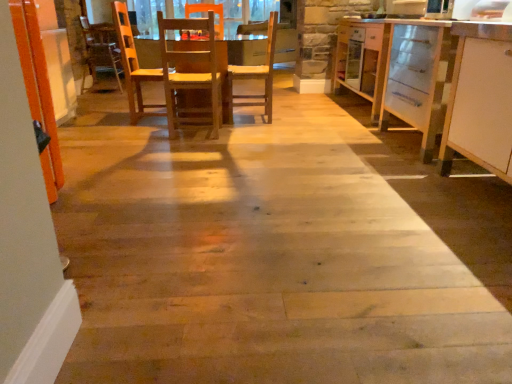
Measure the distance between white matte cabinet at right and camera.

The distance of white matte cabinet at right from camera is 6.53 feet.

What is the approximate height of white matte cabinet at right?

white matte cabinet at right is 3.32 feet tall.

Find the location of a particular element. wooden table at center is located at coordinates (246, 48).

The height and width of the screenshot is (384, 512). In order to click on wooden chair at center, which is counted as the 1th chair, starting from the right in this screenshot , I will do `click(255, 76)`.

Is white matte cabinet at right oriented away from wooden table at center?

white matte cabinet at right does not have its back to wooden table at center.

Consider the image. Between white matte cabinet at right and wooden table at center, which one has smaller width?

With smaller width is white matte cabinet at right.

Is point (471, 82) in front of point (152, 64)?

Yes, point (471, 82) is in front of point (152, 64).

Based on the photo, is white matte cabinet at right bigger than wooden table at center?

Incorrect, white matte cabinet at right is not larger than wooden table at center.

What's the angular difference between white matte cabinet at right and wooden chair at center, the second chair from the right,'s facing directions?

There is a 90.3-degree angle between the facing directions of white matte cabinet at right and wooden chair at center, the second chair from the right.

Is white matte cabinet at right turned away from wooden chair at center, marked as the 1th chair in a left-to-right arrangement?

No.

Based on the photo, considering the relative sizes of white matte cabinet at right and wooden chair at center, the second chair from the right, in the image provided, is white matte cabinet at right shorter than wooden chair at center, the second chair from the right,?

Incorrect, the height of white matte cabinet at right does not fall short of that of wooden chair at center, the second chair from the right.

Measure the distance from white matte cabinet at right to wooden chair at center, the second chair from the right.

The distance of white matte cabinet at right from wooden chair at center, the second chair from the right, is 1.91 meters.

Is wooden table at center turned away from wooden chair at center, the second chair from the right?

Yes, wooden table at center is positioned with its back facing wooden chair at center, the second chair from the right.

At what (x,y) coordinates should I click in order to perform the action: click on table behind the wooden chair at center, marked as the 1th chair in a left-to-right arrangement. Please return your answer as a coordinate pair (x, y). Image resolution: width=512 pixels, height=384 pixels. Looking at the image, I should click on coord(246,48).

From a real-world perspective, which is physically below, wooden table at center or wooden chair at center, marked as the 1th chair in a left-to-right arrangement?

In real-world perspective, wooden table at center is lower.

From the image's perspective, is wooden table at center below wooden chair at center, marked as the 1th chair in a left-to-right arrangement?

No, from the image's perspective, wooden table at center is not beneath wooden chair at center, marked as the 1th chair in a left-to-right arrangement.

Is white matte cabinet at right thinner than wooden chair at center, which is counted as the 1th chair, starting from the right?

In fact, white matte cabinet at right might be wider than wooden chair at center, which is counted as the 1th chair, starting from the right.

Is white matte cabinet at right not close to wooden chair at center, which is counted as the 1th chair, starting from the right?

Absolutely, white matte cabinet at right is distant from wooden chair at center, which is counted as the 1th chair, starting from the right.

Is white matte cabinet at right turned away from wooden chair at center, which is counted as the 1th chair, starting from the right?

No, wooden chair at center, which is counted as the 1th chair, starting from the right, is not at the back of white matte cabinet at right.

Is wooden chair at center, which is counted as the 1th chair, starting from the right, completely or partially inside white matte cabinet at right?

No, wooden chair at center, which is counted as the 1th chair, starting from the right, is not a part of white matte cabinet at right.

Is wooden table at center further to camera compared to white matte cabinet at right?

That is True.

Considering the positions of objects wooden table at center and white matte cabinet at right in the image provided, who is more to the right, wooden table at center or white matte cabinet at right?

Positioned to the right is white matte cabinet at right.

From the picture: Could you tell me if wooden table at center is turned towards white matte cabinet at right?

No, wooden table at center is not oriented towards white matte cabinet at right.

From the picture: Do you think wooden table at center is within white matte cabinet at right, or outside of it?

wooden table at center is not inside white matte cabinet at right, it's outside.

In the scene shown: Who is bigger, wooden chair at center, the 2th chair in the left-to-right sequence, or white matte cabinet at right?

white matte cabinet at right is bigger.

Which object is positioned more to the left, wooden chair at center, the 2th chair in the left-to-right sequence, or white matte cabinet at right?

wooden chair at center, the 2th chair in the left-to-right sequence, is more to the left.

Is wooden chair at center, the 2th chair in the left-to-right sequence, wider than white matte cabinet at right?

No.

Between wooden chair at center, which is counted as the 1th chair, starting from the right, and white matte cabinet at right, which one is positioned behind?

wooden chair at center, which is counted as the 1th chair, starting from the right, is further from the camera.

Is wooden chair at center, marked as the 1th chair in a left-to-right arrangement, outside of white matte cabinet at right?

Yes, wooden chair at center, marked as the 1th chair in a left-to-right arrangement, is located beyond the bounds of white matte cabinet at right.

In the image, is wooden chair at center, the second chair from the right, on the left side or the right side of white matte cabinet at right?

In the image, wooden chair at center, the second chair from the right, appears on the left side of white matte cabinet at right.

From the image's perspective, which one is positioned lower, wooden chair at center, marked as the 1th chair in a left-to-right arrangement, or white matte cabinet at right?

From the image's view, white matte cabinet at right is below.

What are the coordinates of `cabinetry above the wooden table at center (from a real-world perspective)` in the screenshot? It's located at (480, 100).

You are a GUI agent. You are given a task and a screenshot of the screen. Output one action in this format:
    pyautogui.click(x=<x>, y=<y>)
    Task: Click on the 2nd chair to the left of the white matte cabinet at right, starting your count from the anchor
    The height and width of the screenshot is (384, 512).
    Given the screenshot: What is the action you would take?
    pyautogui.click(x=191, y=74)

When comparing their distances from wooden table at center, does white matte cabinet at right or wooden chair at center, the second chair from the right, seem further?

white matte cabinet at right lies further to wooden table at center than the other object.

Considering their positions, is wooden chair at center, marked as the 1th chair in a left-to-right arrangement, positioned further to white matte cabinet at right than wooden chair at center, the 2th chair in the left-to-right sequence?

wooden chair at center, marked as the 1th chair in a left-to-right arrangement, is positioned further to the anchor white matte cabinet at right.

Based on their spatial positions, is wooden chair at center, the second chair from the right, or white matte cabinet at right closer to wooden chair at center, the 2th chair in the left-to-right sequence?

The object closer to wooden chair at center, the 2th chair in the left-to-right sequence, is wooden chair at center, the second chair from the right.

From the image, which object appears to be farther from wooden chair at center, the 2th chair in the left-to-right sequence, wooden table at center or white matte cabinet at right?

A: Based on the image, white matte cabinet at right appears to be further to wooden chair at center, the 2th chair in the left-to-right sequence.

Estimate the real-world distances between objects in this image. Which object is closer to wooden table at center, wooden chair at center, the second chair from the right, or white matte cabinet at right?

Based on the image, wooden chair at center, the second chair from the right, appears to be nearer to wooden table at center.

Considering their positions, is wooden table at center positioned closer to white matte cabinet at right than wooden chair at center, the second chair from the right?

wooden chair at center, the second chair from the right, lies closer to white matte cabinet at right than the other object.

When comparing their distances from wooden table at center, does white matte cabinet at right or wooden chair at center, which is counted as the 1th chair, starting from the right, seem closer?

wooden chair at center, which is counted as the 1th chair, starting from the right, is closer to wooden table at center.

Based on their spatial positions, is white matte cabinet at right or wooden table at center further from wooden chair at center, which is counted as the 1th chair, starting from the right?

Based on the image, white matte cabinet at right appears to be further to wooden chair at center, which is counted as the 1th chair, starting from the right.

Locate an element on the screen. This screenshot has width=512, height=384. table between wooden chair at center, marked as the 1th chair in a left-to-right arrangement, and wooden chair at center, which is counted as the 1th chair, starting from the right, from left to right is located at coordinates (246, 48).

What are the coordinates of `table positioned between white matte cabinet at right and wooden chair at center, which is counted as the 1th chair, starting from the right, from near to far` in the screenshot? It's located at (246, 48).

This screenshot has height=384, width=512. I want to click on chair between white matte cabinet at right and wooden chair at center, the 2th chair in the left-to-right sequence, from front to back, so click(191, 74).

This screenshot has width=512, height=384. Identify the location of table between wooden chair at center, marked as the 1th chair in a left-to-right arrangement, and white matte cabinet at right, in the horizontal direction. (246, 48).